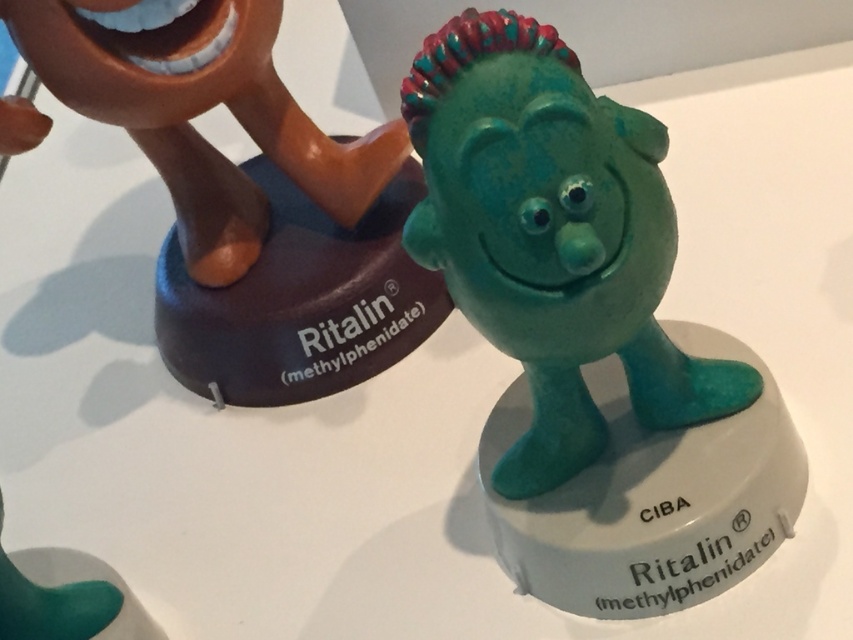
You are a museum visitor looking at the two figurines. The teal rubber figure at center and the matte brown figure at upper left are part of an exhibit. Which figurine is closer to you?

The teal rubber figure at center is closer to you because it is in front of the matte brown figure at upper left.

You are an art curator arranging an exhibit. You have a teal rubber figure at center and a larger figurine in the background. You need to place a new display label at point (552, 236). Will the label obscure the view of the teal rubber figure at center?

The teal rubber figure at center is located at point (552, 236), so placing the label there would directly obscure its view.